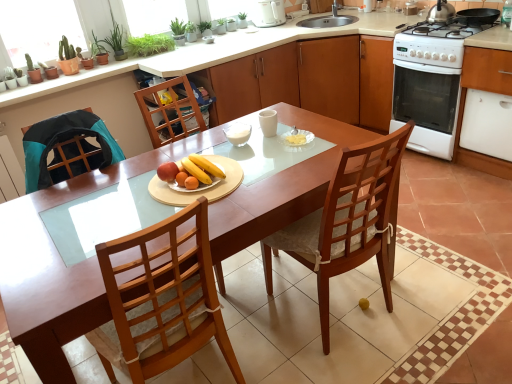
Question: Is yellow matte bananas at center, the first fruit dish from the right, not within wooden cabinet at center, the second cabinetry in the right-to-left sequence?

Choices:
 (A) yes
 (B) no

Answer: (A)

Question: Is yellow matte bananas at center, the second fruit dish viewed from the left, closer to the viewer compared to wooden cabinet at center, the 2th cabinetry from the front?

Choices:
 (A) yes
 (B) no

Answer: (A)

Question: Is yellow matte bananas at center, the first fruit dish from the right, positioned behind wooden cabinet at center, which ranks as the 1th cabinetry in left-to-right order?

Choices:
 (A) no
 (B) yes

Answer: (A)

Question: Is wooden cabinet at center, which ranks as the 1th cabinetry in left-to-right order, inside yellow matte bananas at center, the first fruit dish from the right?

Choices:
 (A) no
 (B) yes

Answer: (A)

Question: Is green leafy plant at upper left wider or thinner than smooth wooden plate with fruits at center, which ranks as the 1th fruit dish in left-to-right order?

Choices:
 (A) wide
 (B) thin

Answer: (B)

Question: Is green leafy plant at upper left inside the boundaries of smooth wooden plate with fruits at center, which ranks as the 1th fruit dish in left-to-right order, or outside?

Choices:
 (A) inside
 (B) outside

Answer: (B)

Question: Considering the positions of green leafy plant at upper left and smooth wooden plate with fruits at center, the second fruit dish from the right, in the image, is green leafy plant at upper left taller or shorter than smooth wooden plate with fruits at center, the second fruit dish from the right,?

Choices:
 (A) short
 (B) tall

Answer: (B)

Question: From a real-world perspective, relative to smooth wooden plate with fruits at center, the second fruit dish from the right, is green leafy plant at upper left vertically above or below?

Choices:
 (A) below
 (B) above

Answer: (B)

Question: From their relative heights in the image, would you say wooden chair at center is taller or shorter than white glossy electric kettle at upper center?

Choices:
 (A) short
 (B) tall

Answer: (B)

Question: In terms of width, does wooden chair at center look wider or thinner when compared to white glossy electric kettle at upper center?

Choices:
 (A) thin
 (B) wide

Answer: (B)

Question: Based on their positions, is wooden chair at center located to the left or right of white glossy electric kettle at upper center?

Choices:
 (A) left
 (B) right

Answer: (B)

Question: From the image's perspective, relative to white glossy electric kettle at upper center, is wooden chair at center above or below?

Choices:
 (A) below
 (B) above

Answer: (A)

Question: Based on their positions, is wooden cabinet at center, which ranks as the 1th cabinetry in left-to-right order, located to the left or right of stainless steel kettle at upper right?

Choices:
 (A) left
 (B) right

Answer: (A)

Question: Is wooden cabinet at center, the second cabinetry in the right-to-left sequence, situated inside stainless steel kettle at upper right or outside?

Choices:
 (A) inside
 (B) outside

Answer: (B)